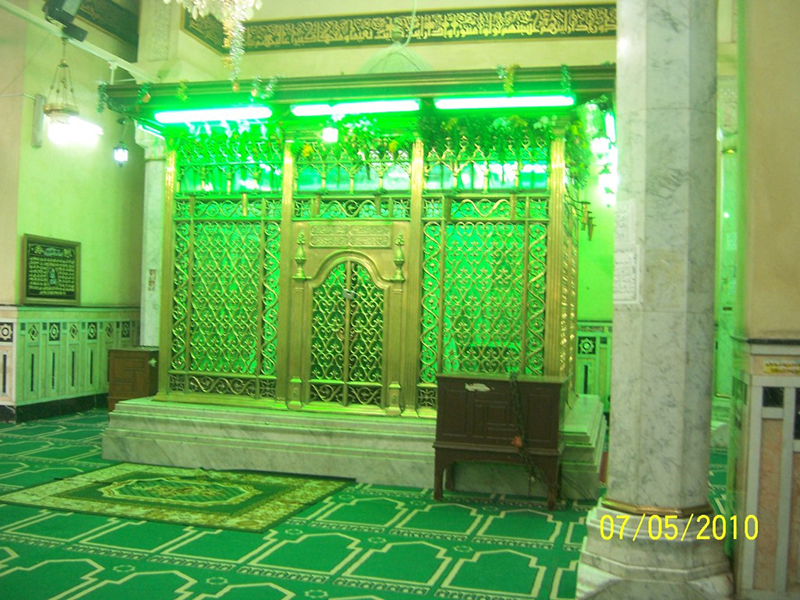
Where is `carpet/tile floor`? This screenshot has height=600, width=800. carpet/tile floor is located at coordinates (330, 556).